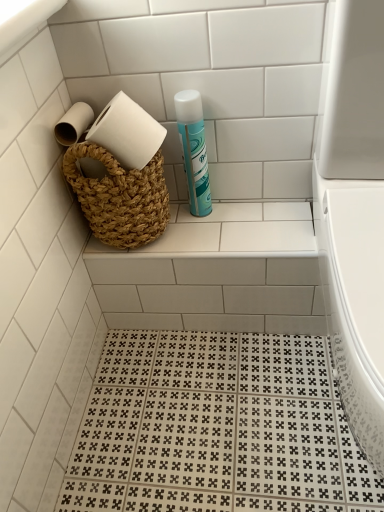
Where is `blank space situated above natural woven basket at upper center (from a real-world perspective)`? This screenshot has width=384, height=512. blank space situated above natural woven basket at upper center (from a real-world perspective) is located at coordinates (211, 222).